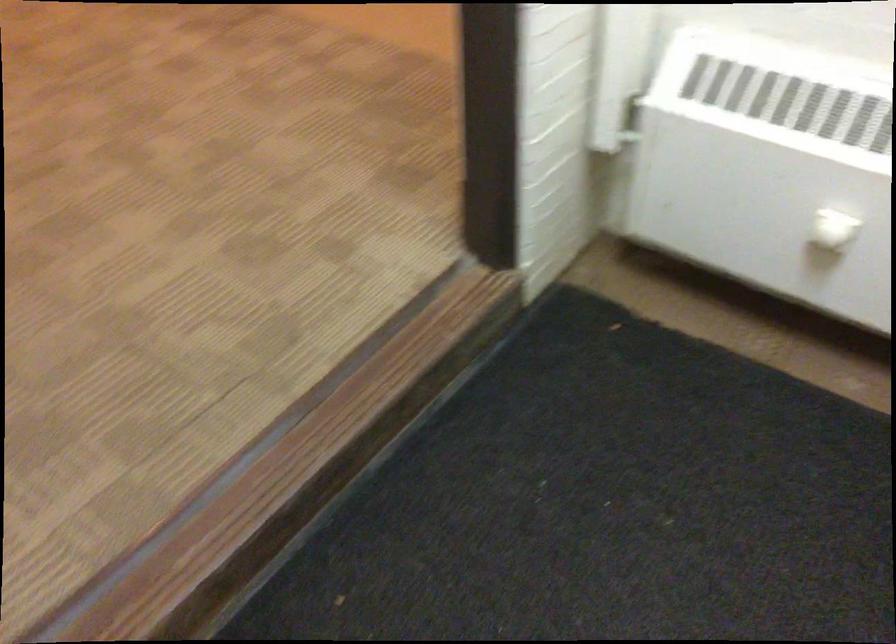
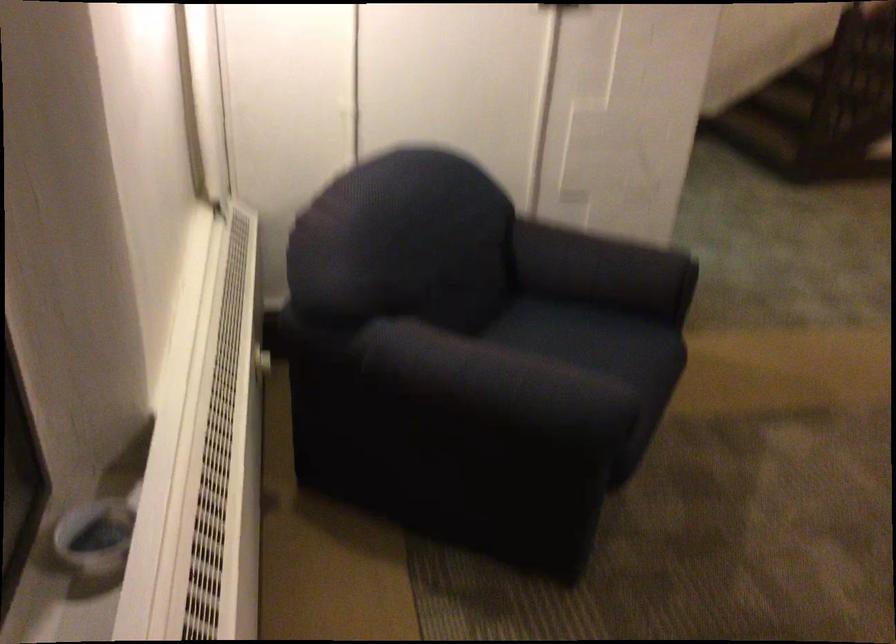
Question: I am providing you with two images of the same scene from different viewpoints. Which of the following objects are not visible in image2?

Choices:
 (A) dark blue armrest
 (B) white radiator knob
 (C) black kettle
 (D) chair sitting surface

Answer: (B)